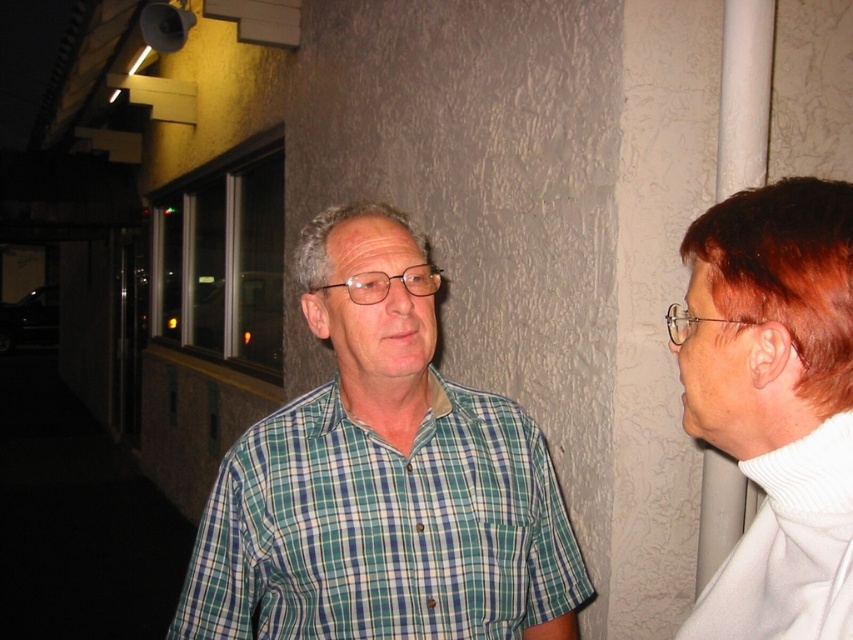
Question: Among these points, which one is nearest to the camera?

Choices:
 (A) (807, 193)
 (B) (757, 301)
 (C) (828, 458)

Answer: (C)

Question: Which point is closer to the camera taking this photo?

Choices:
 (A) (830, 264)
 (B) (527, 600)
 (C) (785, 476)
 (D) (769, 570)

Answer: (A)

Question: Can you confirm if green plaid shirt at center is positioned below white ribbed sweater at right?

Choices:
 (A) yes
 (B) no

Answer: (B)

Question: Which of the following is the farthest from the observer?

Choices:
 (A) (413, 228)
 (B) (844, 285)

Answer: (A)

Question: Is white fleece at right behind white ribbed sweater at right?

Choices:
 (A) no
 (B) yes

Answer: (B)

Question: Observing the image, what is the correct spatial positioning of green plaid shirt at center in reference to dark red hair at right?

Choices:
 (A) left
 (B) right

Answer: (A)